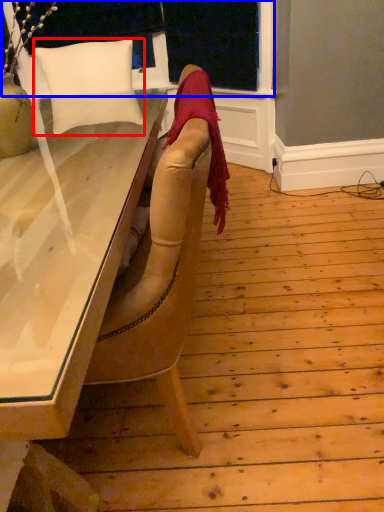
Question: Which object appears farthest to the camera in this image, pillow (highlighted by a red box) or window frame (highlighted by a blue box)?

Choices:
 (A) pillow
 (B) window frame

Answer: (B)